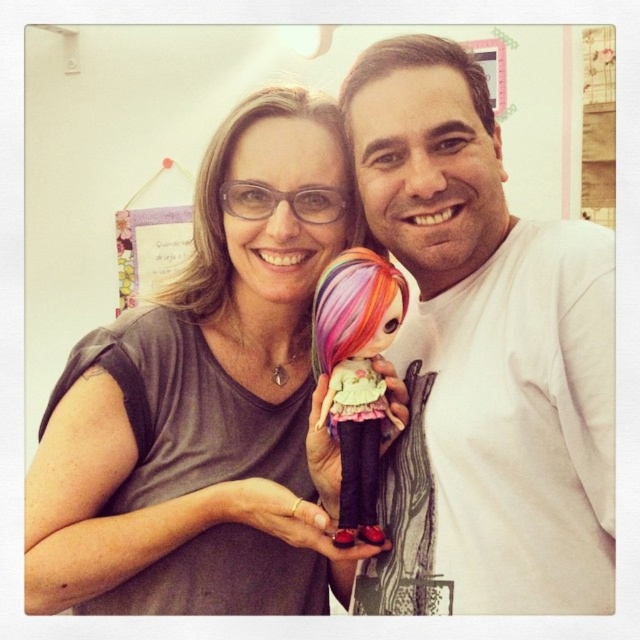
Question: Based on their relative distances, which object is farther from the blonde hair at upper center?

Choices:
 (A) matte gray shirt at center
 (B) brown matte hair at upper center
 (C) rainbow hair doll at center
 (D) white matte shirt at center

Answer: (D)

Question: Considering the relative positions of matte gray shirt at center and rainbow hair doll at center in the image provided, where is matte gray shirt at center located with respect to rainbow hair doll at center?

Choices:
 (A) above
 (B) below

Answer: (A)

Question: Which point is farther to the camera?

Choices:
 (A) rainbow hair doll at center
 (B) brown matte hair at upper center
 (C) white matte shirt at center

Answer: (B)

Question: Can you confirm if white matte shirt at center is positioned above brown matte hair at upper center?

Choices:
 (A) no
 (B) yes

Answer: (A)

Question: Is white matte shirt at center thinner than blonde hair at upper center?

Choices:
 (A) yes
 (B) no

Answer: (A)

Question: Which point is closer to the camera?

Choices:
 (A) (198, 195)
 (B) (358, 83)
 (C) (552, 522)

Answer: (C)